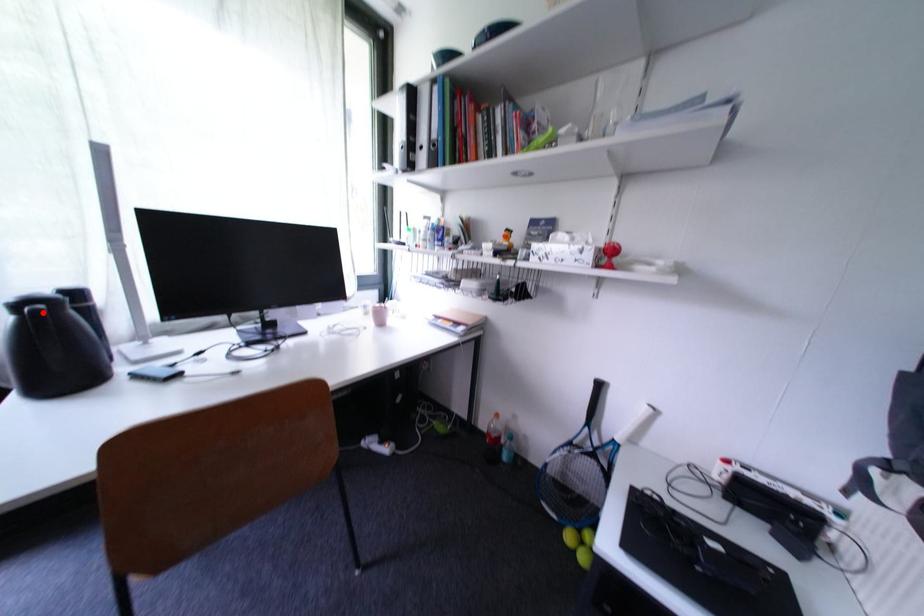
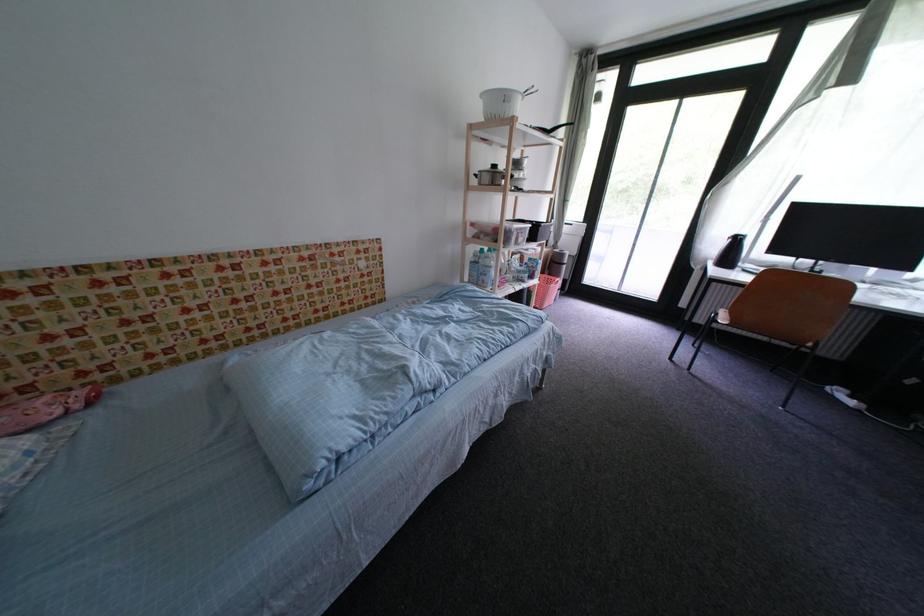
In the second image, find the point that corresponds to the highlighted location in the first image.

(747, 241)